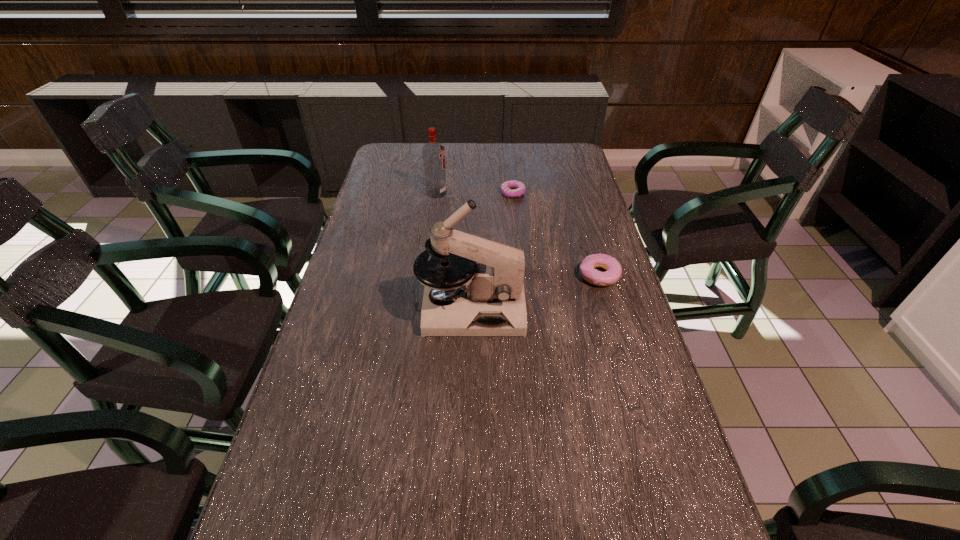
Image resolution: width=960 pixels, height=540 pixels. In order to click on object positioned at the right edge in this screenshot , I will do `click(613, 267)`.

Find the location of a particular element. The height and width of the screenshot is (540, 960). free space at the far edge of the desktop is located at coordinates click(493, 152).

In the image, there is a desktop. Where is `vacant space at the left edge`? vacant space at the left edge is located at coordinates (382, 262).

Find the location of a particular element. vacant space at the right edge of the desktop is located at coordinates (586, 354).

In the image, there is a desktop. Where is `vacant space at the far right corner`? This screenshot has height=540, width=960. vacant space at the far right corner is located at coordinates pos(586,168).

Find the location of `free space between the shorter doughnut and the vodka`. free space between the shorter doughnut and the vodka is located at coordinates (474, 193).

This screenshot has height=540, width=960. Find the location of `free spot between the shortest object and the vodka`. free spot between the shortest object and the vodka is located at coordinates (474, 193).

The height and width of the screenshot is (540, 960). What are the coordinates of `free space that is in between the second tallest object and the right doughnut` in the screenshot? It's located at (517, 234).

Identify the location of free spot between the vodka and the third tallest object. (517, 234).

At what (x,y) coordinates should I click in order to perform the action: click on object that ranks as the third closest to the nearer doughnut. Please return your answer as a coordinate pair (x, y). Looking at the image, I should click on (433, 153).